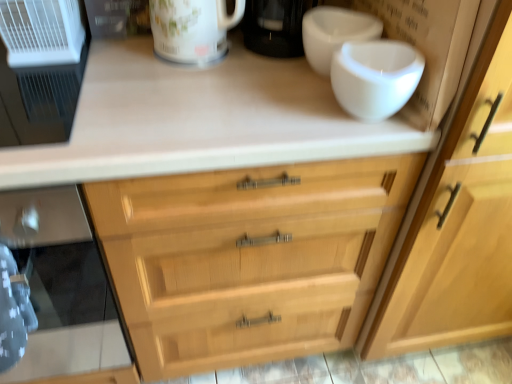
Locate an element on the screen. The height and width of the screenshot is (384, 512). white plastic air purifier at left, which is the 1th appliance from bottom to top is located at coordinates (38, 101).

Describe the element at coordinates (334, 33) in the screenshot. This screenshot has width=512, height=384. I see `white glossy bowl at upper right` at that location.

Describe the element at coordinates (41, 32) in the screenshot. I see `white plastic cage at upper left, the first appliance in the top-to-bottom sequence` at that location.

Where is `white plastic air purifier at left, which appears as the second appliance when viewed from the top`? Image resolution: width=512 pixels, height=384 pixels. white plastic air purifier at left, which appears as the second appliance when viewed from the top is located at coordinates (38, 101).

Where is `mug located on the right of white plastic cage at upper left, the first appliance in the top-to-bottom sequence`? Image resolution: width=512 pixels, height=384 pixels. mug located on the right of white plastic cage at upper left, the first appliance in the top-to-bottom sequence is located at coordinates (192, 29).

Is white plastic cage at upper left, the first appliance in the top-to-bottom sequence, facing away from glossy ceramic mug at upper center?

No.

Which is behind, point (37, 38) or point (174, 15)?

Point (37, 38)

Does glossy ceramic mug at upper center have a smaller size compared to black glass oven at left?

Correct, glossy ceramic mug at upper center occupies less space than black glass oven at left.

Is black glass oven at left completely or partially inside glossy ceramic mug at upper center?

No, black glass oven at left is not a part of glossy ceramic mug at upper center.

How different are the orientations of glossy ceramic mug at upper center and black glass oven at left in degrees?

glossy ceramic mug at upper center and black glass oven at left are facing 1.44 degrees away from each other.

Is glossy ceramic mug at upper center oriented away from black glass oven at left?

glossy ceramic mug at upper center is not turned away from black glass oven at left.

From a real-world perspective, does white plastic cage at upper left, the first appliance in the top-to-bottom sequence, stand above white plastic air purifier at left, which appears as the second appliance when viewed from the top?

Indeed, from a real-world perspective, white plastic cage at upper left, the first appliance in the top-to-bottom sequence, stands above white plastic air purifier at left, which appears as the second appliance when viewed from the top.

Considering the positions of point (55, 61) and point (84, 54), is point (55, 61) closer or farther from the camera than point (84, 54)?

Point (55, 61) is positioned closer to the camera compared to point (84, 54).

Looking at the image, does white plastic cage at upper left, which is counted as the second appliance, starting from the bottom, seem bigger or smaller compared to white plastic air purifier at left, which is the 1th appliance from bottom to top?

Considering their sizes, white plastic cage at upper left, which is counted as the second appliance, starting from the bottom, takes up less space than white plastic air purifier at left, which is the 1th appliance from bottom to top.

Consider the image. Is white plastic cage at upper left, which is counted as the second appliance, starting from the bottom, positioned with its back to white plastic air purifier at left, which is the 1th appliance from bottom to top?

white plastic cage at upper left, which is counted as the second appliance, starting from the bottom, does not have its back to white plastic air purifier at left, which is the 1th appliance from bottom to top.

Consider the image. Considering the sizes of objects black glass oven at left and white plastic air purifier at left, which is the 1th appliance from bottom to top, in the image provided, who is smaller, black glass oven at left or white plastic air purifier at left, which is the 1th appliance from bottom to top,?

With smaller size is white plastic air purifier at left, which is the 1th appliance from bottom to top.

Could you tell me if black glass oven at left is turned towards white plastic air purifier at left, which is the 1th appliance from bottom to top?

No, black glass oven at left is not facing towards white plastic air purifier at left, which is the 1th appliance from bottom to top.

From the image's perspective, which one is positioned higher, black glass oven at left or white plastic air purifier at left, which appears as the second appliance when viewed from the top?

white plastic air purifier at left, which appears as the second appliance when viewed from the top.

Does black glass oven at left have a lesser width compared to white plastic air purifier at left, which appears as the second appliance when viewed from the top?

No, black glass oven at left is not thinner than white plastic air purifier at left, which appears as the second appliance when viewed from the top.

Which of these two, black glass oven at left or white plastic cage at upper left, the first appliance in the top-to-bottom sequence, is wider?

black glass oven at left.

Looking at this image, can you tell me how much black glass oven at left and white plastic cage at upper left, the first appliance in the top-to-bottom sequence, differ in facing direction?

There is a 0.254-degree angle between the facing directions of black glass oven at left and white plastic cage at upper left, the first appliance in the top-to-bottom sequence.

Considering the positions of objects black glass oven at left and white plastic cage at upper left, which is counted as the second appliance, starting from the bottom, in the image provided, who is behind, black glass oven at left or white plastic cage at upper left, which is counted as the second appliance, starting from the bottom,?

white plastic cage at upper left, which is counted as the second appliance, starting from the bottom, is further away from the camera.

Which is correct: black glass oven at left is inside white plastic cage at upper left, the first appliance in the top-to-bottom sequence, or outside of it?

black glass oven at left is located beyond the bounds of white plastic cage at upper left, the first appliance in the top-to-bottom sequence.

Is glossy ceramic mug at upper center to the left of white glossy bowl at upper right from the viewer's perspective?

Indeed, glossy ceramic mug at upper center is positioned on the left side of white glossy bowl at upper right.

Is glossy ceramic mug at upper center facing towards white glossy bowl at upper right?

No, glossy ceramic mug at upper center is not oriented towards white glossy bowl at upper right.

From the image's perspective, which one is positioned lower, glossy ceramic mug at upper center or white glossy bowl at upper right?

white glossy bowl at upper right is shown below in the image.

Identify the location of basin below the glossy ceramic mug at upper center (from a real-world perspective). (334, 33).

From the picture: Can glossy ceramic mug at upper center be found inside white glossy bowl at upper right?

That's incorrect, glossy ceramic mug at upper center is not inside white glossy bowl at upper right.

Measure the distance between white glossy bowl at upper right and glossy ceramic mug at upper center.

20.34 centimeters.

Which is more to the left, white glossy bowl at upper right or glossy ceramic mug at upper center?

From the viewer's perspective, glossy ceramic mug at upper center appears more on the left side.

Is white glossy bowl at upper right directly adjacent to glossy ceramic mug at upper center?

No.

In order to click on mug that appears on the right of white plastic cage at upper left, which is counted as the second appliance, starting from the bottom in this screenshot , I will do `click(192, 29)`.

Locate an element on the screen. oven on the left of glossy ceramic mug at upper center is located at coordinates (64, 292).

Which object lies further to the anchor point white plastic cage at upper left, the first appliance in the top-to-bottom sequence, black glass oven at left or glossy ceramic mug at upper center?

black glass oven at left is positioned further to the anchor white plastic cage at upper left, the first appliance in the top-to-bottom sequence.

From the image, which object appears to be nearer to black glass oven at left, white glossy bowl at upper right or white plastic cage at upper left, which is counted as the second appliance, starting from the bottom?

Among the two, white plastic cage at upper left, which is counted as the second appliance, starting from the bottom, is located nearer to black glass oven at left.

Based on their spatial positions, is white plastic cage at upper left, which is counted as the second appliance, starting from the bottom, or white glossy bowl at upper right closer to glossy ceramic mug at upper center?

The object closer to glossy ceramic mug at upper center is white glossy bowl at upper right.

From the picture: Looking at the image, which one is located closer to glossy ceramic mug at upper center, black glass oven at left or white plastic cage at upper left, the first appliance in the top-to-bottom sequence?

Based on the image, white plastic cage at upper left, the first appliance in the top-to-bottom sequence, appears to be nearer to glossy ceramic mug at upper center.

Based on their spatial positions, is white plastic air purifier at left, which appears as the second appliance when viewed from the top, or glossy ceramic mug at upper center closer to black glass oven at left?

Based on the image, white plastic air purifier at left, which appears as the second appliance when viewed from the top, appears to be nearer to black glass oven at left.

When comparing their distances from white glossy bowl at upper right, does white plastic air purifier at left, which is the 1th appliance from bottom to top, or black glass oven at left seem further?

Among the two, black glass oven at left is located further to white glossy bowl at upper right.

From the image, which object appears to be farther from glossy ceramic mug at upper center, white plastic air purifier at left, which is the 1th appliance from bottom to top, or white glossy bowl at upper right?

white plastic air purifier at left, which is the 1th appliance from bottom to top, is further to glossy ceramic mug at upper center.

Estimate the real-world distances between objects in this image. Which object is closer to white glossy bowl at upper right, black glass oven at left or white plastic air purifier at left, which appears as the second appliance when viewed from the top?

white plastic air purifier at left, which appears as the second appliance when viewed from the top, is positioned closer to the anchor white glossy bowl at upper right.

Where is `appliance situated between white plastic cage at upper left, which is counted as the second appliance, starting from the bottom, and glossy ceramic mug at upper center from left to right`? appliance situated between white plastic cage at upper left, which is counted as the second appliance, starting from the bottom, and glossy ceramic mug at upper center from left to right is located at coordinates (38, 101).

Identify the location of mug between white plastic cage at upper left, the first appliance in the top-to-bottom sequence, and white glossy bowl at upper right from left to right. (192, 29).

The image size is (512, 384). Find the location of `appliance between glossy ceramic mug at upper center and black glass oven at left in the vertical direction`. appliance between glossy ceramic mug at upper center and black glass oven at left in the vertical direction is located at coordinates click(x=38, y=101).

Identify the location of appliance between white plastic cage at upper left, the first appliance in the top-to-bottom sequence, and white glossy bowl at upper right from left to right. (38, 101).